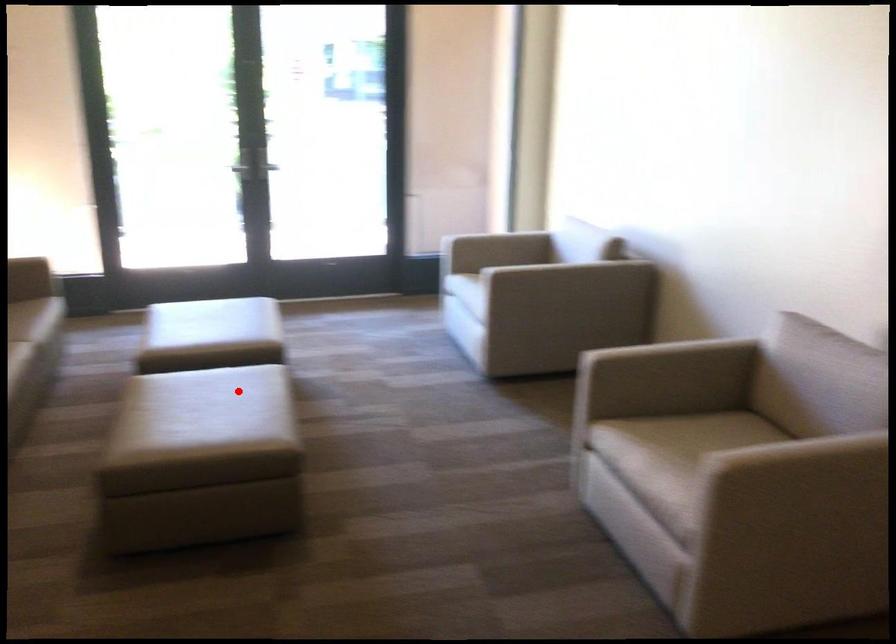
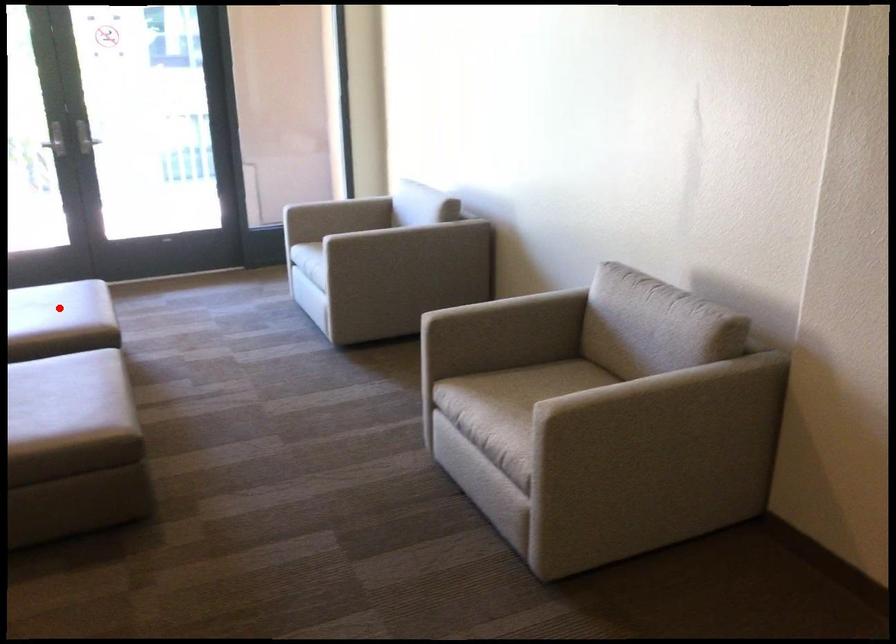
I am providing you with two images of the same scene from different viewpoints. A red point is marked on the first image and another point is marked on the second image. Does the point marked in image1 correspond to the same location as the one in image2?

No